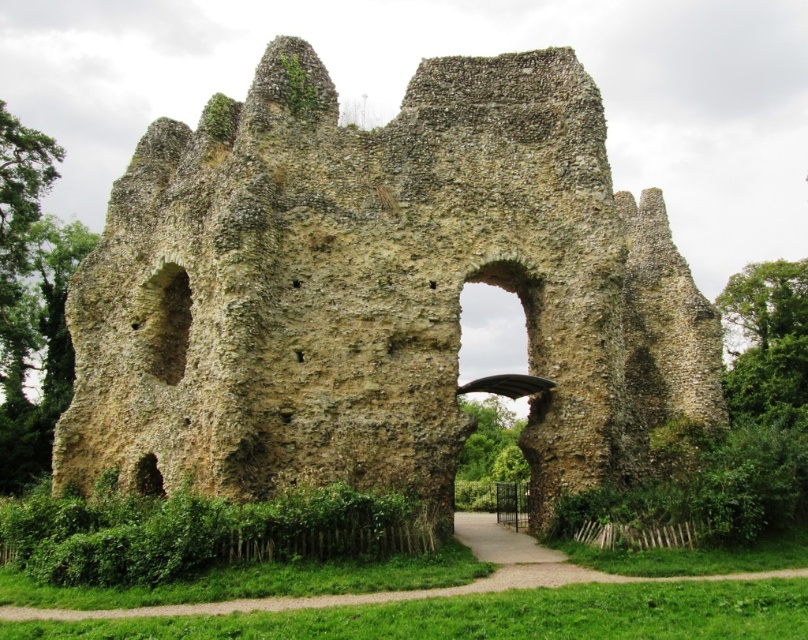
Does rustic stone ruins at center have a smaller size compared to stone archway at center?

Incorrect, rustic stone ruins at center is not smaller in size than stone archway at center.

Between rustic stone ruins at center and stone archway at center, which one is positioned lower?

stone archway at center

Identify the location of rustic stone ruins at center. (377, 289).